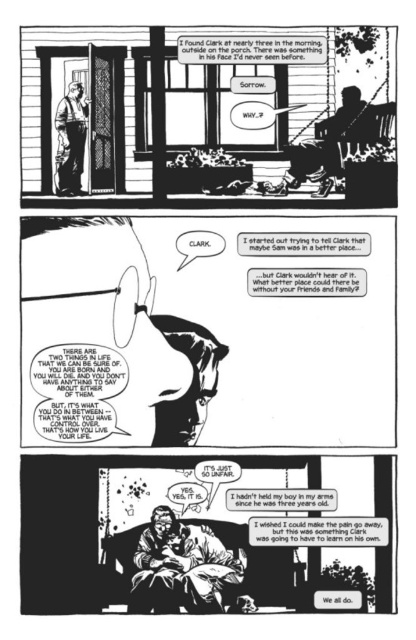
Question: Does smooth glass eye at center appear under matte black baby at center?

Choices:
 (A) no
 (B) yes

Answer: (A)

Question: Is smooth glass eye at center wider than matte black baby at center?

Choices:
 (A) no
 (B) yes

Answer: (B)

Question: Is smooth glass eye at center to the left of matte black baby at center from the viewer's perspective?

Choices:
 (A) yes
 (B) no

Answer: (A)